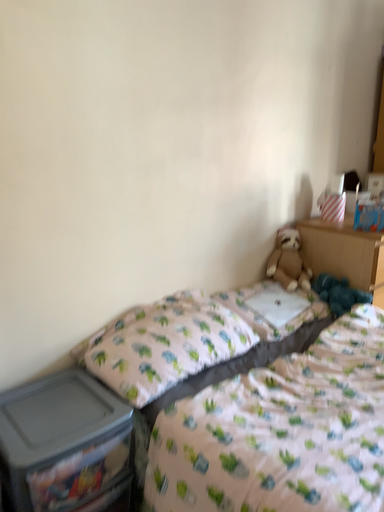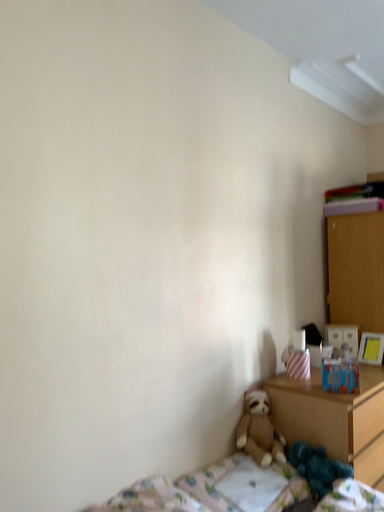
Question: Which way did the camera rotate in the video?

Choices:
 (A) rotated upward
 (B) rotated downward

Answer: (A)